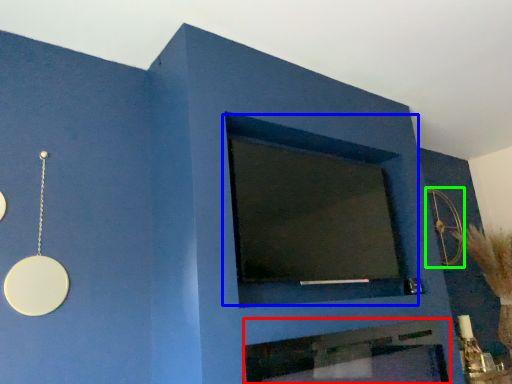
Question: Estimate the real-world distances between objects in this image. Which object is farther from fireplace (highlighted by a red box), window (highlighted by a blue box) or circle (highlighted by a green box)?

Choices:
 (A) window
 (B) circle

Answer: (B)